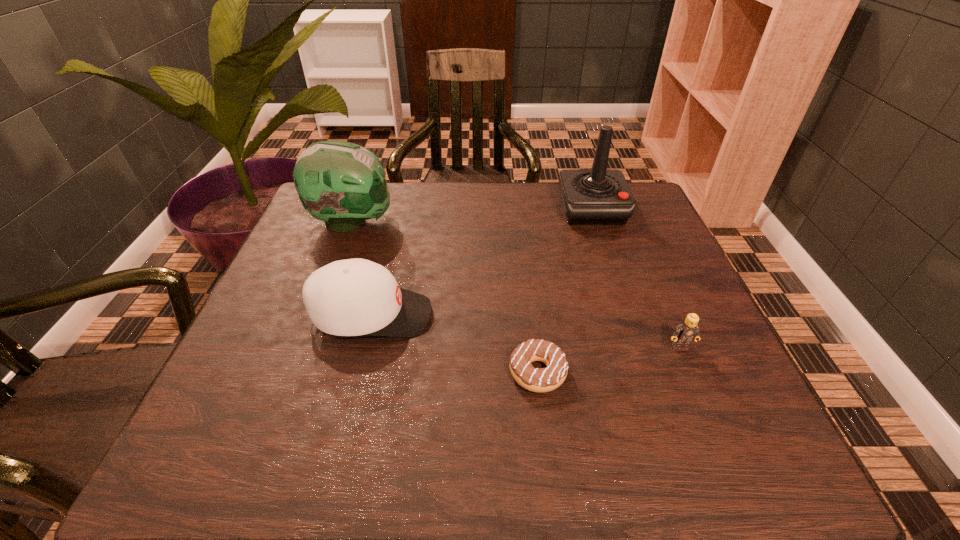
The image size is (960, 540). In order to click on joystick in this screenshot , I will do `click(599, 196)`.

Locate an element on the screen. football helmet is located at coordinates (342, 183).

Identify the location of the third tallest object. (352, 297).

The width and height of the screenshot is (960, 540). Identify the location of Lego. (685, 333).

Find the location of a particular element. Image resolution: width=960 pixels, height=540 pixels. the shortest object is located at coordinates (540, 380).

At what (x,y) coordinates should I click in order to perform the action: click on doughnut. Please return your answer as a coordinate pair (x, y). The image size is (960, 540). Looking at the image, I should click on (540, 380).

Find the location of a particular element. The image size is (960, 540). vacant point located on the front-facing side of the joystick is located at coordinates (614, 276).

Find the location of a particular element. This screenshot has width=960, height=540. vacant space located 0.360m on the visor of the football helmet is located at coordinates (532, 222).

Where is `free location located 0.150m on the front-facing side of the third tallest object`? free location located 0.150m on the front-facing side of the third tallest object is located at coordinates (505, 315).

Identify the location of free space located in front of the fourth tallest object. The width and height of the screenshot is (960, 540). (710, 418).